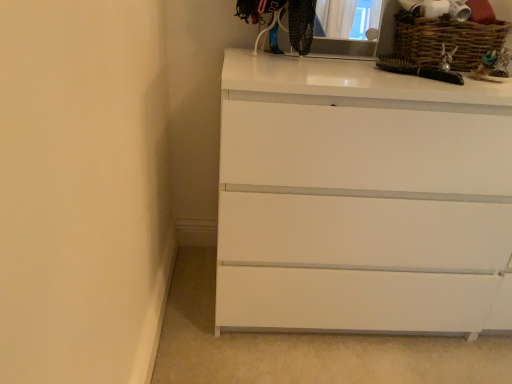
In order to click on free space in front of matte black medicine cabinet at upper center in this screenshot , I will do `click(324, 63)`.